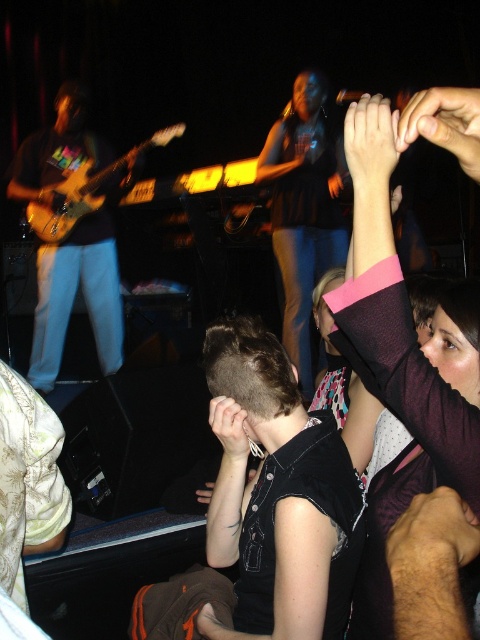
Is leather-like hand at upper right in front of matte black hand at center?

That is True.

Is point (442, 586) farther from viewer compared to point (238, 419)?

No, (442, 586) is in front of (238, 419).

Who is more forward, (474, 544) or (236, 408)?

Point (474, 544)

The image size is (480, 640). In order to click on leather-like hand at upper right in this screenshot , I will do `click(432, 544)`.

Where is `matte black guitar at left`? The width and height of the screenshot is (480, 640). matte black guitar at left is located at coordinates (73, 298).

Who is positioned more to the left, matte black guitar at left or wooden electric guitar at left?

From the viewer's perspective, matte black guitar at left appears more on the left side.

This screenshot has width=480, height=640. What do you see at coordinates (73, 298) in the screenshot?
I see `matte black guitar at left` at bounding box center [73, 298].

This screenshot has width=480, height=640. I want to click on matte black guitar at left, so click(x=73, y=298).